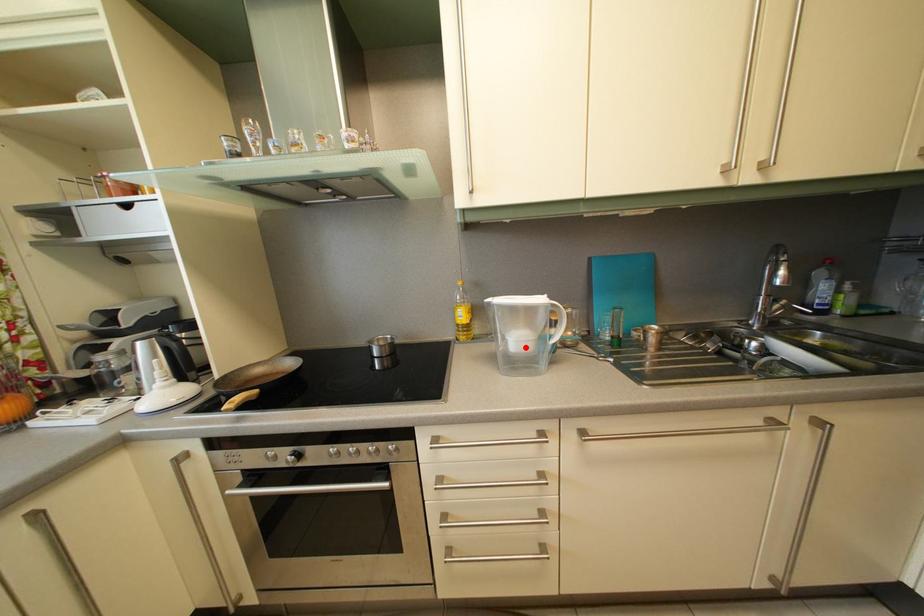
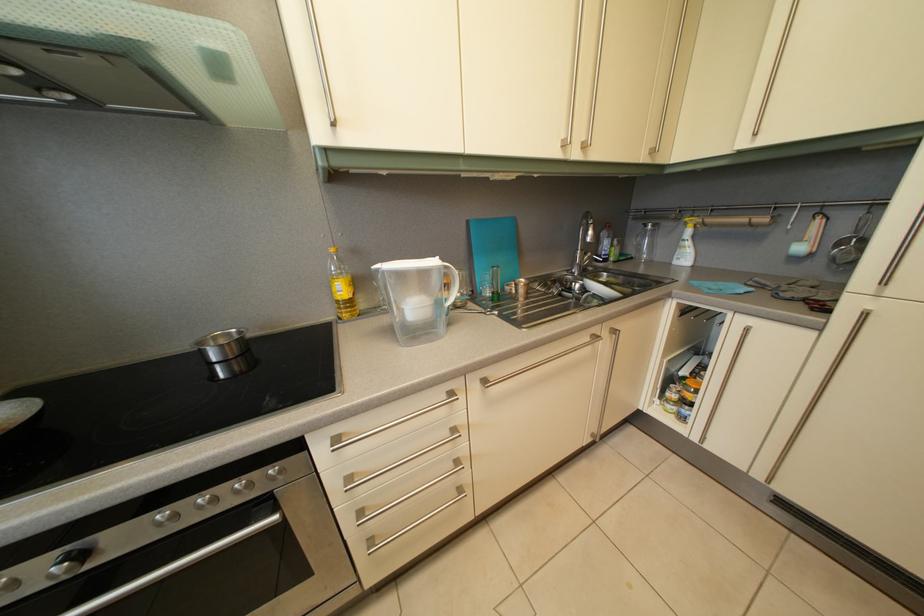
Locate, in the second image, the point that corresponds to the highlighted location in the first image.

(421, 315)